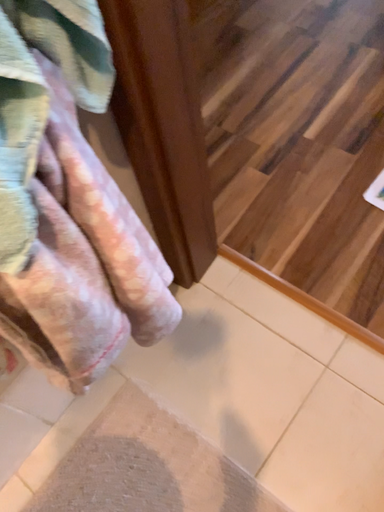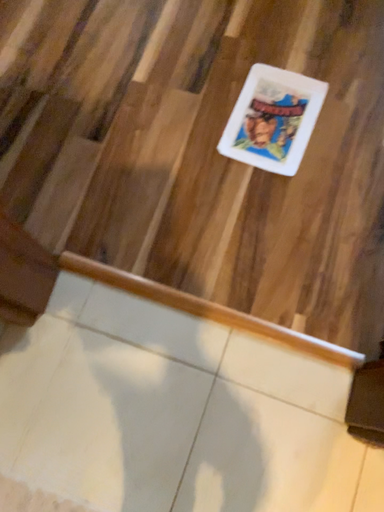
Question: How did the camera likely rotate when shooting the video?

Choices:
 (A) rotated left
 (B) rotated right

Answer: (B)